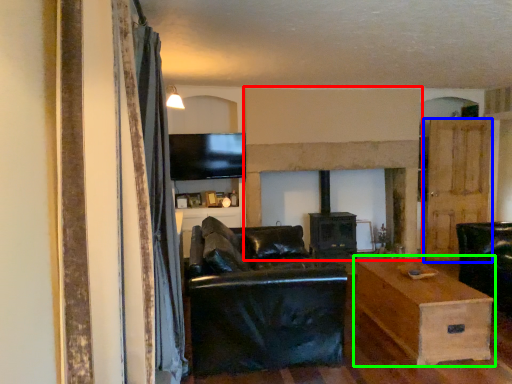
Question: Based on their relative distances, which object is farther from fireplace (highlighted by a red box)? Choose from door (highlighted by a blue box) and table (highlighted by a green box).

Choices:
 (A) door
 (B) table

Answer: (B)